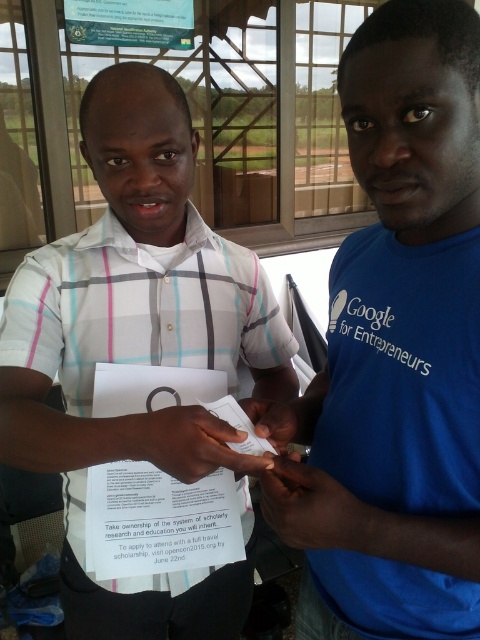
Based on the photo, does blue cotton shirt at right have a lesser width compared to blue cotton t-shirt at center?

No.

Between blue cotton shirt at right and blue cotton t-shirt at center, which one has less height?

With less height is blue cotton t-shirt at center.

Locate an element on the screen. blue cotton shirt at right is located at coordinates (396, 349).

Find the location of a particular element. blue cotton shirt at right is located at coordinates (396, 349).

Who is positioned more to the right, white checkered shirt at center or blue cotton t-shirt at center?

blue cotton t-shirt at center is more to the right.

Is white checkered shirt at center to the left of blue cotton t-shirt at center from the viewer's perspective?

Indeed, white checkered shirt at center is positioned on the left side of blue cotton t-shirt at center.

Is point (271, 340) positioned behind point (380, 304)?

Yes, point (271, 340) is farther from viewer.

Where is `white checkered shirt at center`? The width and height of the screenshot is (480, 640). white checkered shirt at center is located at coordinates (139, 346).

Does blue cotton shirt at right appear under white checkered shirt at center?

No, blue cotton shirt at right is not below white checkered shirt at center.

Is point (464, 454) closer to viewer compared to point (72, 244)?

Yes, it is.

Measure the distance between point [362,113] and camera.

The distance of point [362,113] from camera is 22.93 inches.

You are a GUI agent. You are given a task and a screenshot of the screen. Output one action in this format:
    pyautogui.click(x=<x>, y=<y>)
    Task: Click on the blue cotton shirt at right
    This screenshot has width=480, height=640.
    Given the screenshot: What is the action you would take?
    pyautogui.click(x=396, y=349)